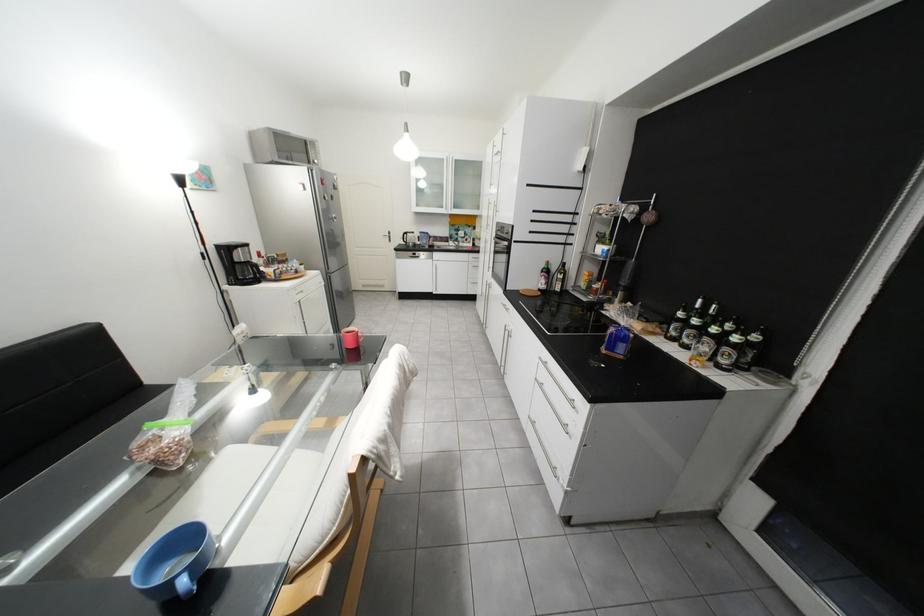
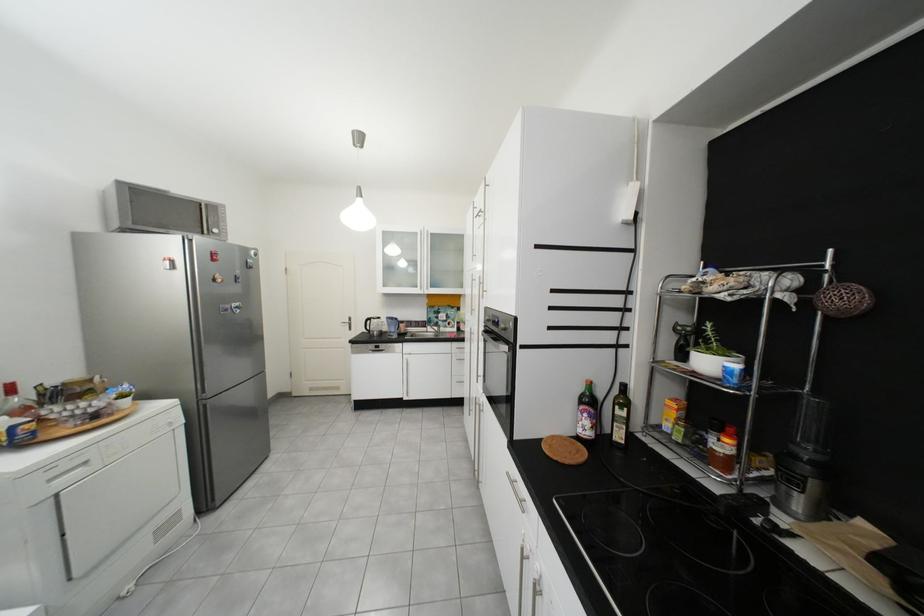
In the second image, find the point that corresponds to (402,238) in the first image.

(361, 325)